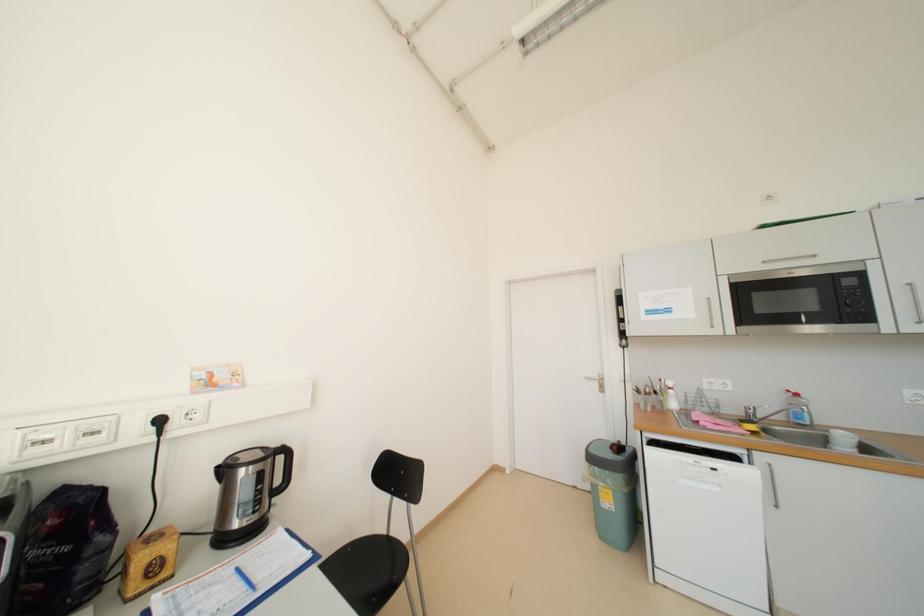
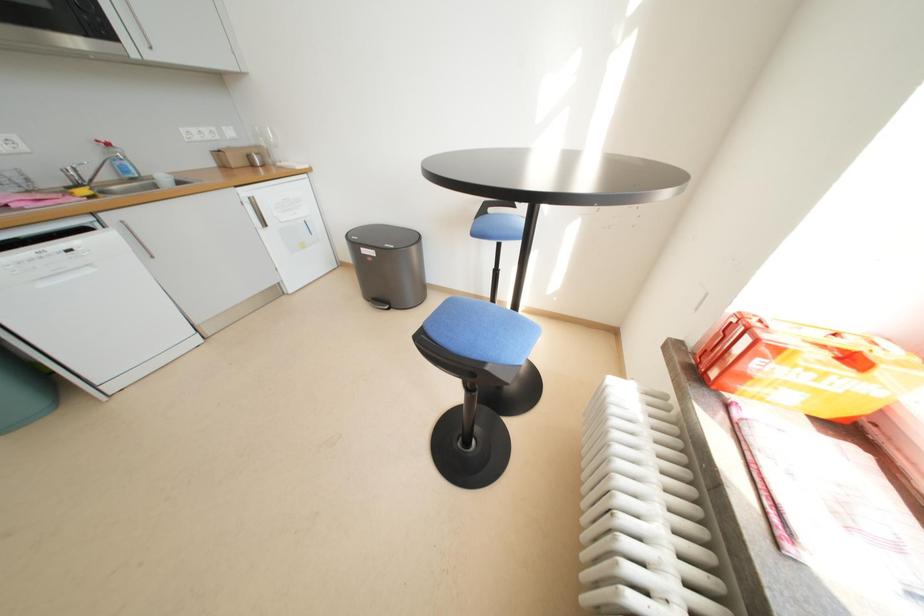
Consider the image. How did the camera likely rotate?

The camera's rotation is toward right-down.